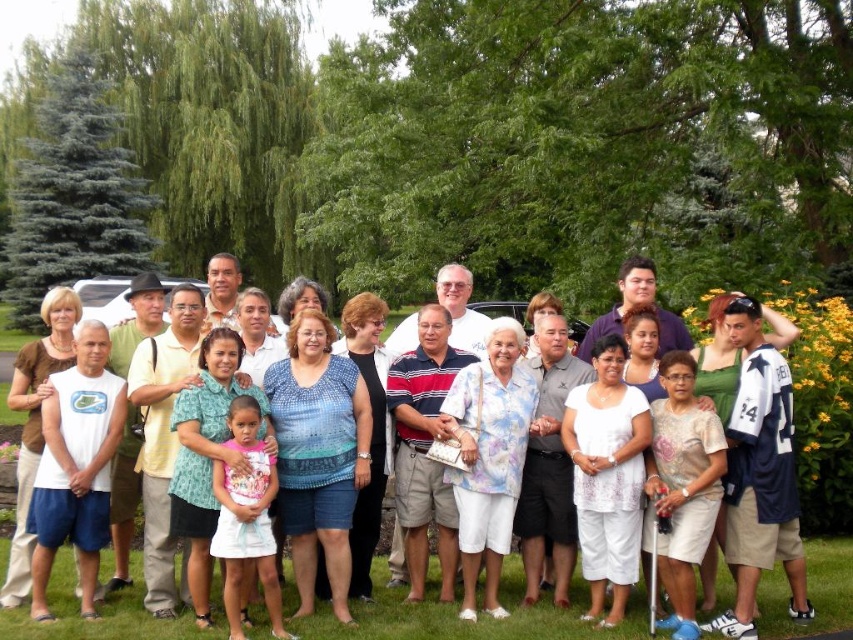
Between white fabric golf course at lower center and white cotton shirt at center, which one is positioned higher?

white cotton shirt at center is higher up.

Is the position of white fabric golf course at lower center less distant than that of white cotton shirt at center?

No, white fabric golf course at lower center is further to the viewer.

Is point (142, 625) closer to viewer compared to point (320, 612)?

Yes, it is.

The height and width of the screenshot is (640, 853). I want to click on white fabric golf course at lower center, so click(x=474, y=624).